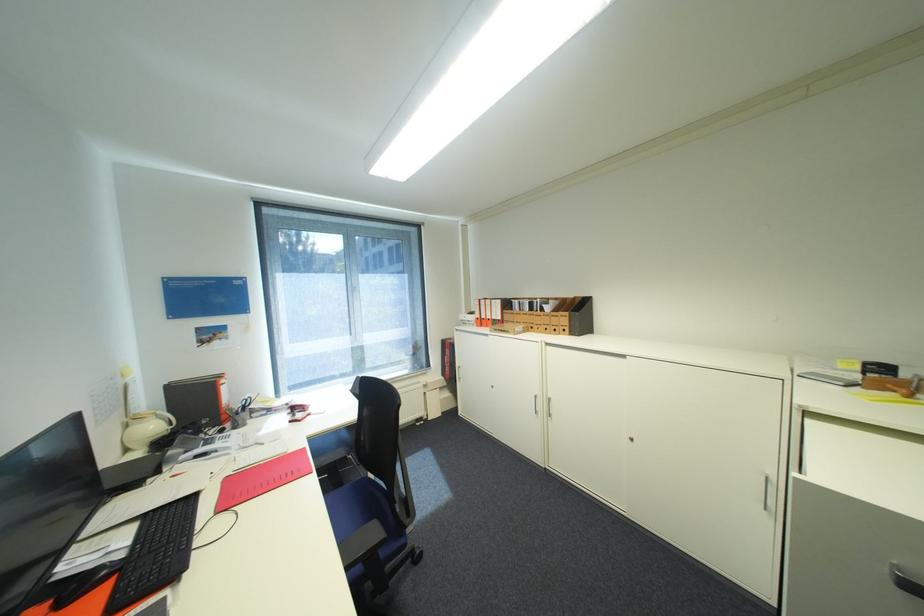
What do you see at coordinates (146, 429) in the screenshot?
I see `the white pitcher handle` at bounding box center [146, 429].